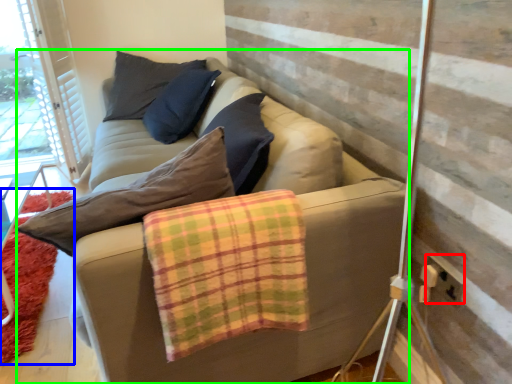
Question: Estimate the real-world distances between objects in this image. Which object is closer to electric outlet (highlighted by a red box), mat (highlighted by a blue box) or studio couch (highlighted by a green box)?

Choices:
 (A) mat
 (B) studio couch

Answer: (B)